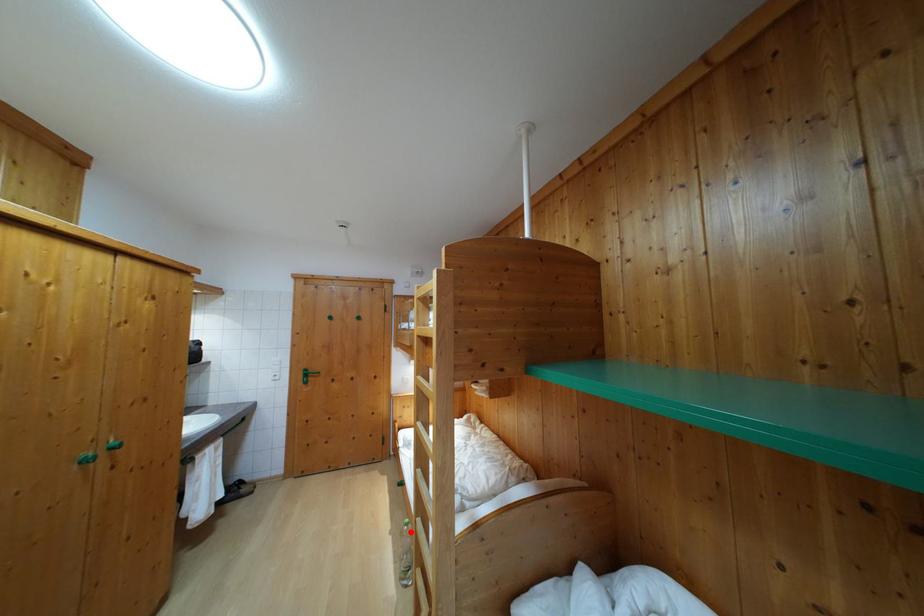
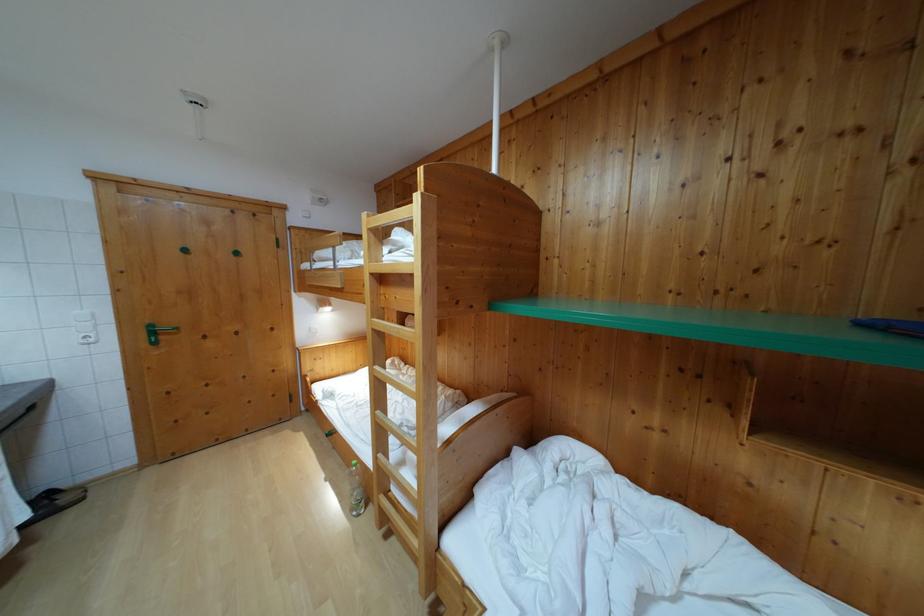
Question: I am providing you with two images of the same scene from different viewpoints. Given a red point in image1, look at the same physical point in image2. Is it:

Choices:
 (A) Closer to the viewpoint
 (B) Farther from the viewpoint

Answer: (B)